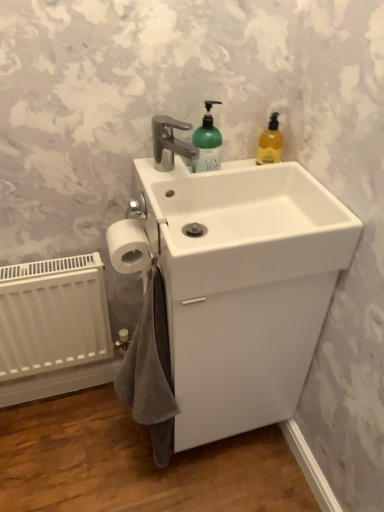
Identify the location of free space to the left of gray cotton bath towel at lower left. (x=100, y=451).